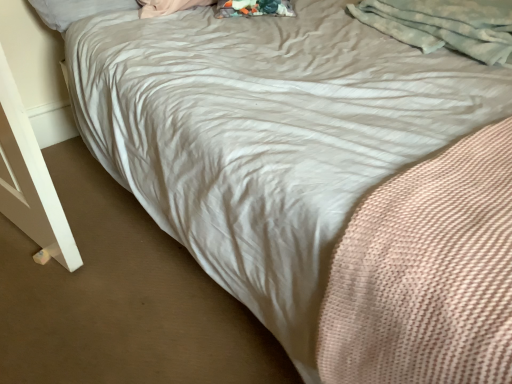
Question: From a real-world perspective, is light gray fluffy blanket at upper right positioned above or below white soft pillow at upper left?

Choices:
 (A) above
 (B) below

Answer: (A)

Question: In terms of height, does light gray fluffy blanket at upper right look taller or shorter compared to white soft pillow at upper left?

Choices:
 (A) short
 (B) tall

Answer: (B)

Question: Does point (477, 18) appear closer or farther from the camera than point (124, 6)?

Choices:
 (A) closer
 (B) farther

Answer: (A)

Question: Considering the positions of white soft pillow at upper left and light gray fluffy blanket at upper right in the image, is white soft pillow at upper left wider or thinner than light gray fluffy blanket at upper right?

Choices:
 (A) wide
 (B) thin

Answer: (B)

Question: Is white soft pillow at upper left situated inside light gray fluffy blanket at upper right or outside?

Choices:
 (A) inside
 (B) outside

Answer: (B)

Question: Visually, is white soft pillow at upper left positioned to the left or to the right of light gray fluffy blanket at upper right?

Choices:
 (A) right
 (B) left

Answer: (B)

Question: From the image's perspective, is white soft pillow at upper left above or below light gray fluffy blanket at upper right?

Choices:
 (A) above
 (B) below

Answer: (A)